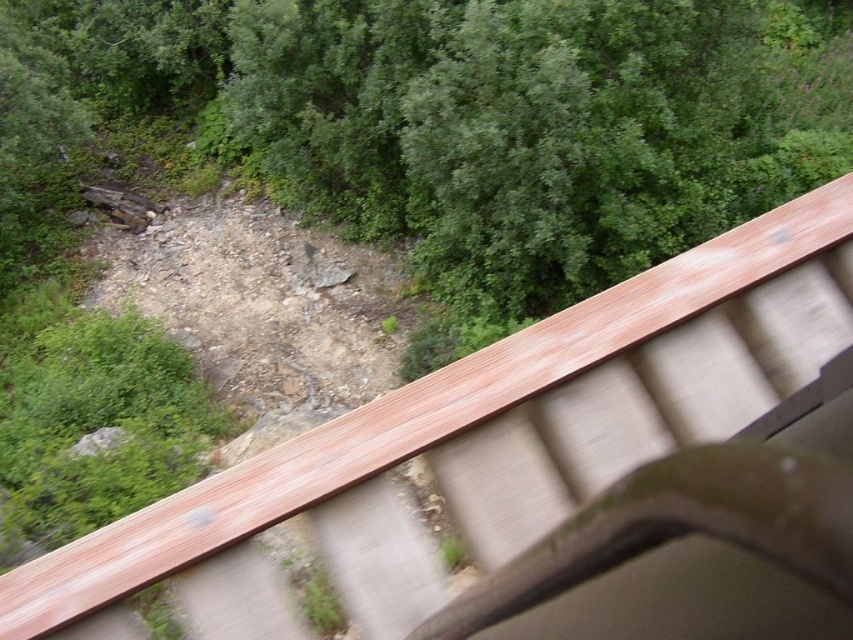
Question: In this image, where is green leafy tree at upper center located relative to wooden rail at upper right?

Choices:
 (A) right
 (B) left

Answer: (A)

Question: Does green leafy tree at upper center appear over wooden rail at upper right?

Choices:
 (A) yes
 (B) no

Answer: (A)

Question: Among these objects, which one is farthest from the camera?

Choices:
 (A) green leafy tree at upper center
 (B) wooden rail at upper right

Answer: (A)

Question: Can you confirm if green leafy tree at upper center is wider than wooden rail at upper right?

Choices:
 (A) yes
 (B) no

Answer: (A)